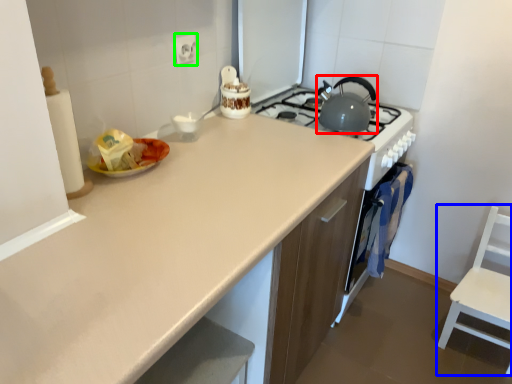
Question: Considering the real-world distances, which object is farthest from kitchen appliance (highlighted by a red box)? chair (highlighted by a blue box) or electric outlet (highlighted by a green box)?

Choices:
 (A) chair
 (B) electric outlet

Answer: (A)